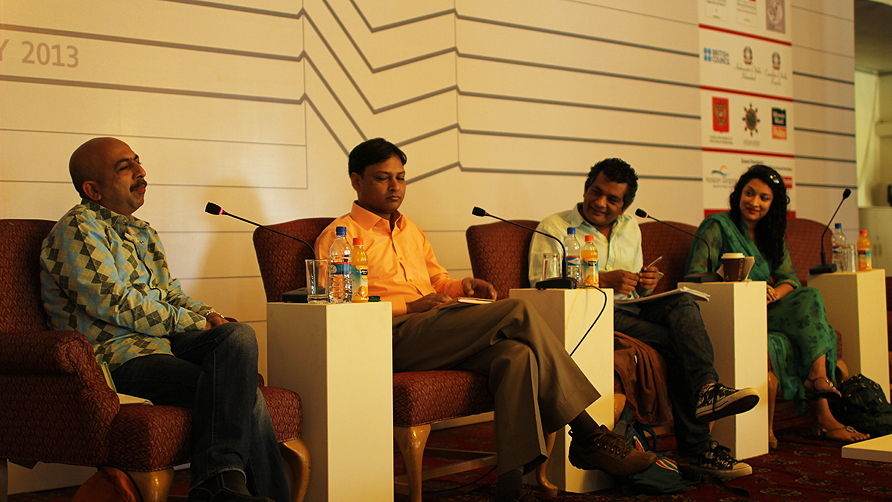
Locate an element on the screen. 2 water bottles on this table is located at coordinates [339, 275], [354, 282].